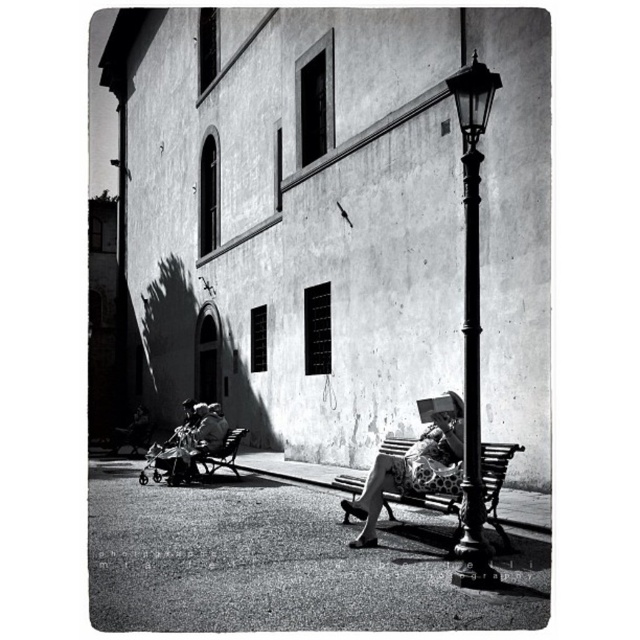
Can you confirm if polka dot dress at center is thinner than smooth fabric stroller at lower left?

No, polka dot dress at center is not thinner than smooth fabric stroller at lower left.

Which of these two, polka dot dress at center or smooth fabric stroller at lower left, stands shorter?

With less height is smooth fabric stroller at lower left.

At what (x,y) coordinates should I click in order to perform the action: click on polka dot dress at center. Please return your answer as a coordinate pair (x, y). Looking at the image, I should click on (410, 467).

Who is higher up, polished metal streetlamp at right or polka dot dress at center?

polished metal streetlamp at right

Between point (467, 486) and point (380, 497), which one is positioned behind?

The point (380, 497) is more distant.

Where is `polished metal streetlamp at right`? This screenshot has height=640, width=640. polished metal streetlamp at right is located at coordinates (472, 320).

Image resolution: width=640 pixels, height=640 pixels. I want to click on polished metal streetlamp at right, so 472,320.

Between polished metal streetlamp at right and smooth fabric stroller at lower left, which one has more height?

polished metal streetlamp at right is taller.

Is polished metal streetlamp at right wider than smooth fabric stroller at lower left?

No, polished metal streetlamp at right is not wider than smooth fabric stroller at lower left.

Find the location of a particular element. polished metal streetlamp at right is located at coordinates (472, 320).